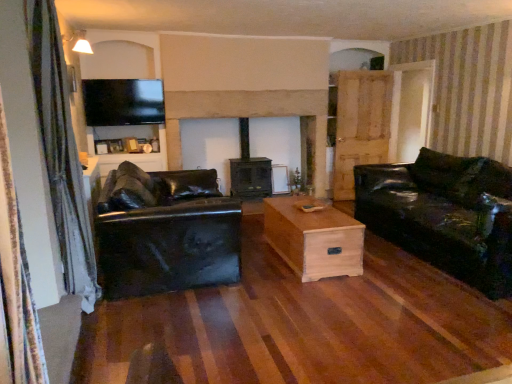
Question: Looking at their shapes, would you say transparent glass door at right is wider or thinner than matte black tv at upper left?

Choices:
 (A) thin
 (B) wide

Answer: (B)

Question: Considering the positions of point (402, 96) and point (134, 82), is point (402, 96) closer or farther from the camera than point (134, 82)?

Choices:
 (A) closer
 (B) farther

Answer: (B)

Question: Which object is the farthest from the transparent glass door at right?

Choices:
 (A) light wood/texture coffee table at center
 (B) glossy black leather couch at right, which is counted as the first studio couch, starting from the right
 (C) black leather couch at left, marked as the 2th studio couch in a right-to-left arrangement
 (D) matte black tv at upper left
 (E) silky blue curtain at left

Answer: (E)

Question: Which of these objects is positioned closest to the matte black tv at upper left?

Choices:
 (A) black leather couch at left, acting as the first studio couch starting from the left
 (B) smooth stone fireplace at center
 (C) transparent glass door at right
 (D) silky blue curtain at left
 (E) matte black tv at upper left

Answer: (E)